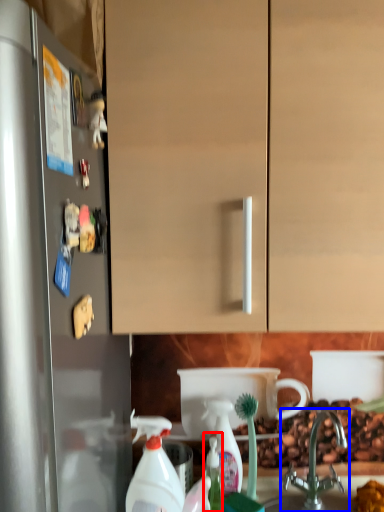
Question: Which of the following is the farthest to the observer, bottle (highlighted by a red box) or tap (highlighted by a blue box)?

Choices:
 (A) bottle
 (B) tap

Answer: (A)